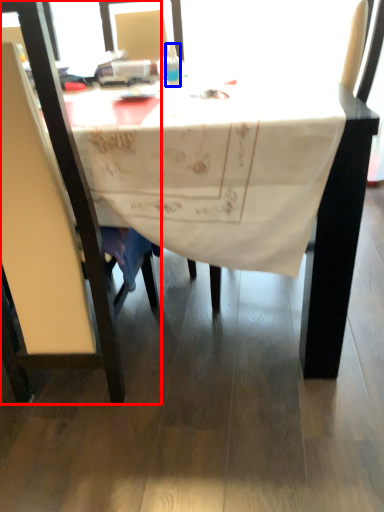
Question: Among these objects, which one is farthest to the camera, chair (highlighted by a red box) or bottle (highlighted by a blue box)?

Choices:
 (A) chair
 (B) bottle

Answer: (B)